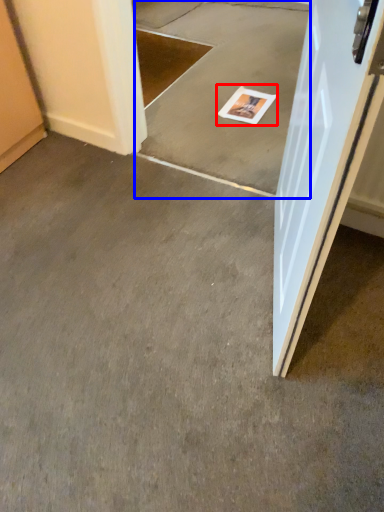
Question: Among these objects, which one is farthest to the camera, magazine (highlighted by a red box) or concrete (highlighted by a blue box)?

Choices:
 (A) magazine
 (B) concrete

Answer: (A)